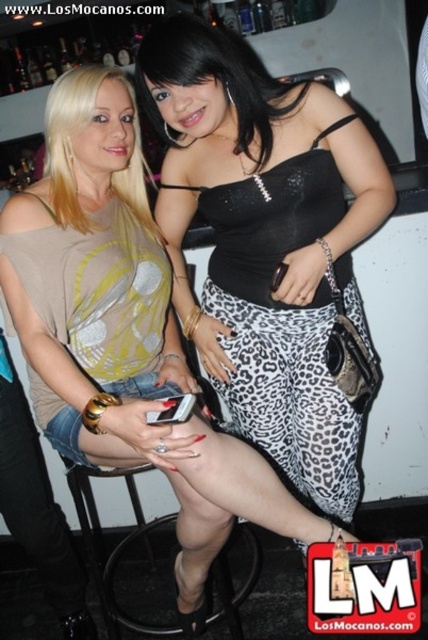
You are a photographer setting up a shoot in the bar. You need to place a 10cm wide decorative item between the black leopard print pants at center and the black plastic bar stool at lower center. Will the space between them be wide enough?

The black leopard print pants at center is thinner than the black plastic bar stool at lower center, so the space between them is sufficient to place a 10cm wide decorative item.

You are a photographer setting up for a photoshoot in a bar. You need to position a model wearing black leopard print pants at center so that they are not blocking the black plastic bar stool at lower center. Based on the scene description, where should the model move?

The black leopard print pants at center is currently on the right side of the black plastic bar stool at lower center. To avoid blocking the stool, the model should move to the left side of the black plastic bar stool at lower center.